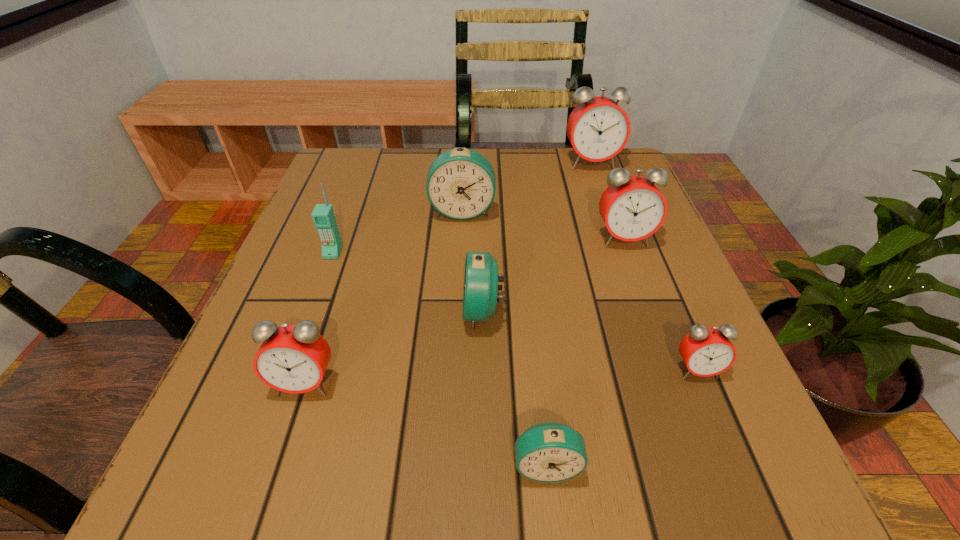
I want to click on free spot that satisfies the following two spatial constraints: 1. on the front-facing side of the third smallest red alarm clock; 2. on the front-facing side of the fourth nearest alarm clock, so click(x=650, y=311).

Image resolution: width=960 pixels, height=540 pixels. Identify the location of free spot that satisfies the following two spatial constraints: 1. on the front-facing side of the second biggest red alarm clock; 2. on the front-facing side of the fourth farthest alarm clock. (650, 311).

Where is `blank area in the image that satisfies the following two spatial constraints: 1. on the front-facing side of the farthest alarm clock; 2. on the front-facing side of the fourth nearest object`? blank area in the image that satisfies the following two spatial constraints: 1. on the front-facing side of the farthest alarm clock; 2. on the front-facing side of the fourth nearest object is located at coordinates (643, 311).